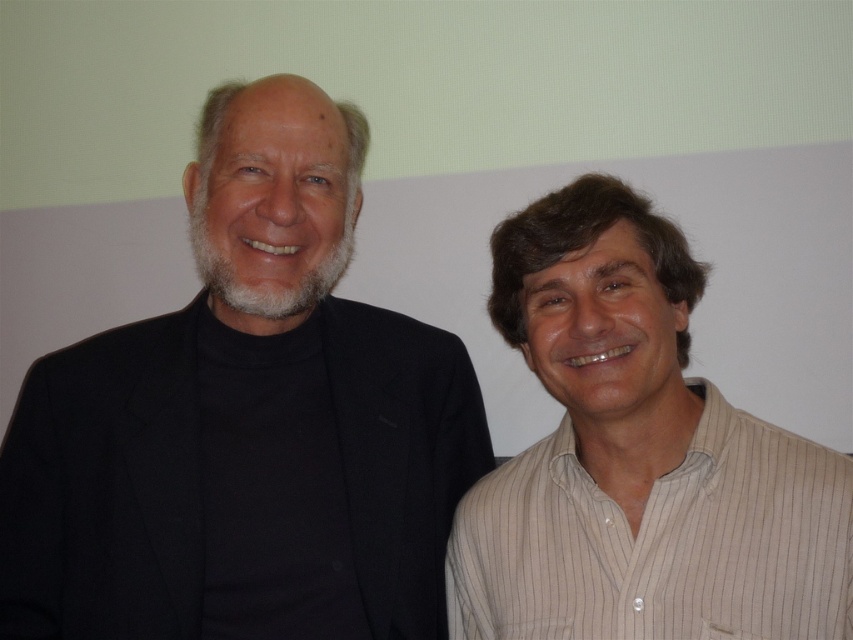
From the picture: You are a photographer setting up for a group photo. You have two subjects wearing the black matte suit at left and the white striped shirt at right. The photographer wants to ensure that the taller subject is placed in the center of the frame. Which subject should be positioned at the center?

The black matte suit at left is much taller than the white striped shirt at right, so the photographer should position the black matte suit at left at the center of the frame to highlight the taller subject.

You are an interior designer and need to place a new sofa in a room. The sofa must be placed at the same position as the black matte suit at left. What are the coordinates for placing the sofa?

The coordinates for placing the sofa should be at point (241, 413), as that is where the black matte suit at left is positioned.